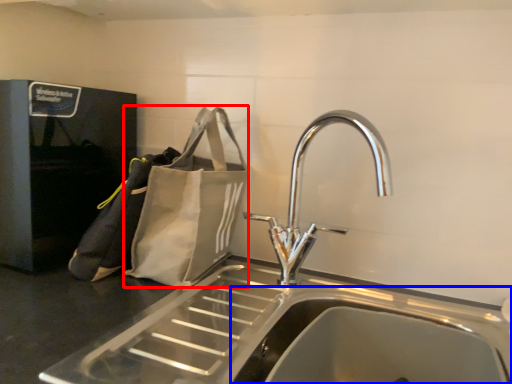
Question: Which object appears farthest to the camera in this image, pouch (highlighted by a red box) or sink (highlighted by a blue box)?

Choices:
 (A) pouch
 (B) sink

Answer: (A)